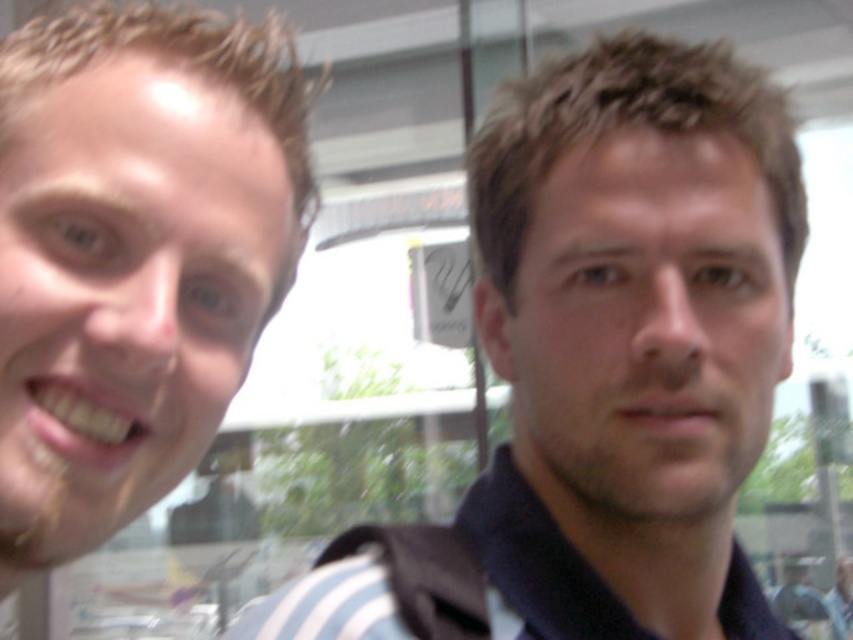
You are a photographer trying to capture a closeup shot of both the brown hair at right and the smooth skin face at left in the same frame. Given that your camera has a maximum focus range of 7 inches, will you be able to capture both subjects clearly?

The brown hair at right and smooth skin face at left are 7.68 inches apart, which exceeds the camera maximum focus range of 7 inches. Therefore, you cannot capture both subjects clearly in the same frame.

You are a photographer trying to capture a closeup of the brown hair at right in the image. The camera is currently focused on the point at coordinates point (x=631, y=333). Based on the scene description, will this focus point ensure the brown hair at right is in focus?

Yes, the point (x=631, y=333) is on the brown hair at right, so focusing there will keep the brown hair at right in focus.